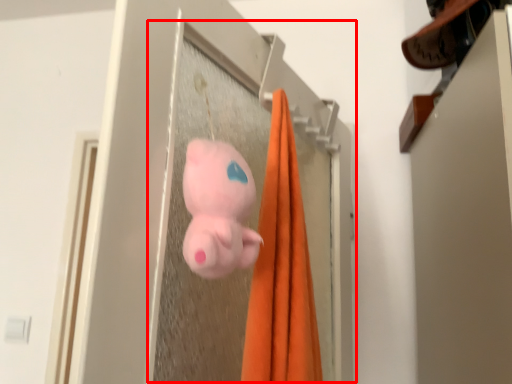
Question: Considering the relative positions of screen door (annotated by the red box) and toy in the image provided, where is screen door (annotated by the red box) located with respect to the staircase?

Choices:
 (A) right
 (B) left

Answer: (A)